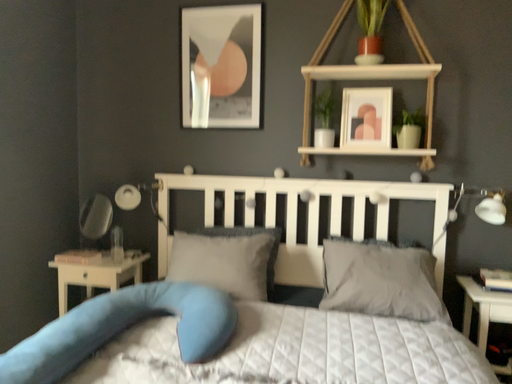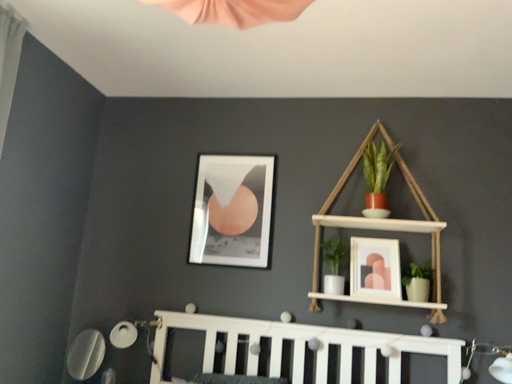
Question: Which way did the camera rotate in the video?

Choices:
 (A) rotated upward
 (B) rotated downward

Answer: (A)